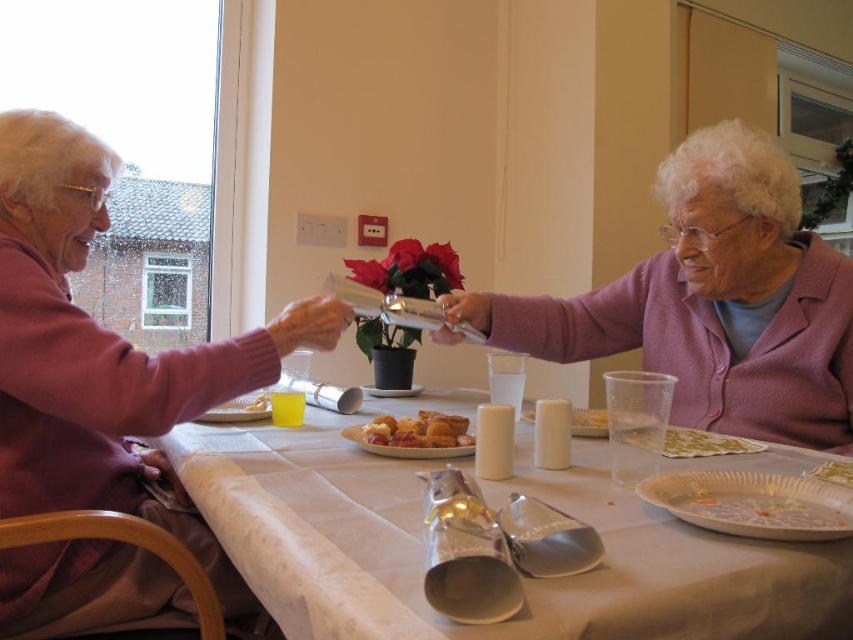
Is golden brown croissant at center closer to the viewer compared to golden-brown crispy pastry at center?

No, golden brown croissant at center is behind golden-brown crispy pastry at center.

Between point (387, 435) and point (389, 451), which one is positioned behind?

Positioned behind is point (387, 435).

Does point (473, 444) lie in front of point (445, 445)?

That is False.

At what (x,y) coordinates should I click in order to perform the action: click on golden brown croissant at center. Please return your answer as a coordinate pair (x, y). The height and width of the screenshot is (640, 853). Looking at the image, I should click on (418, 429).

From the picture: Does pink knitted sweater at upper right have a greater height compared to white paper plate at lower right?

Correct, pink knitted sweater at upper right is much taller as white paper plate at lower right.

Based on the photo, can you confirm if pink knitted sweater at upper right is wider than white paper plate at lower right?

Yes, pink knitted sweater at upper right is wider than white paper plate at lower right.

Who is more distant from viewer, [729,403] or [767,490]?

The point [729,403] is behind.

You are a GUI agent. You are given a task and a screenshot of the screen. Output one action in this format:
    pyautogui.click(x=<x>, y=<y>)
    Task: Click on the pink knitted sweater at upper right
    This screenshot has height=640, width=853.
    Given the screenshot: What is the action you would take?
    pyautogui.click(x=712, y=301)

Does point (341, 472) lie in front of point (619, 312)?

Yes, it is in front of point (619, 312).

Is metallic silver foil at center below pink knitted sweater at upper right?

Yes.

Does point (682, 528) lie in front of point (747, 173)?

Yes, it is.

Locate an element on the screen. This screenshot has width=853, height=640. metallic silver foil at center is located at coordinates tap(492, 506).